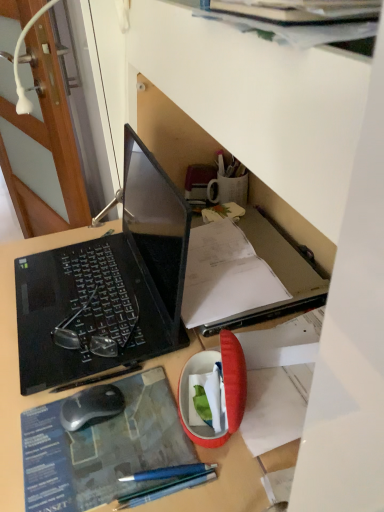
I want to click on free location above blue paper at center (from a real-world perspective), so click(104, 436).